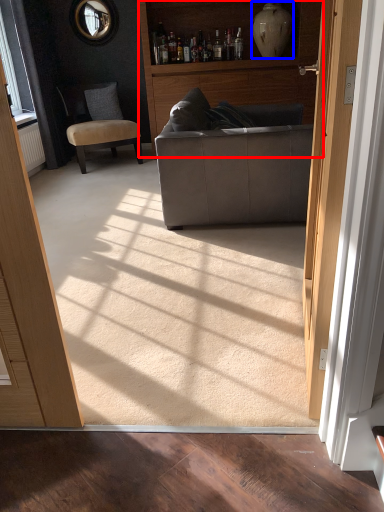
Question: Which object appears closest to the camera in this image, bookshelf (highlighted by a red box) or vase (highlighted by a blue box)?

Choices:
 (A) bookshelf
 (B) vase

Answer: (A)